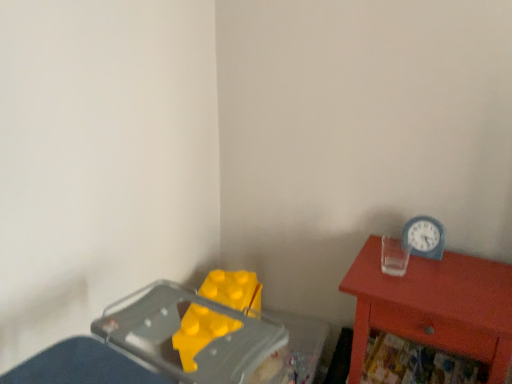
This screenshot has width=512, height=384. In order to click on empty space that is to the right of blue plastic clock at upper right in this screenshot , I will do `click(463, 260)`.